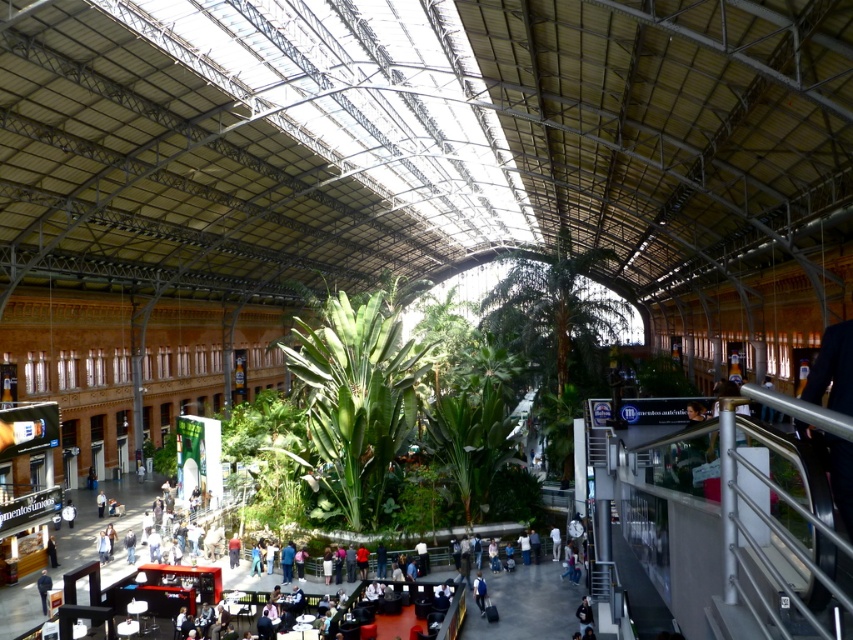
You are standing at the entrance of the station and want to reach the point marked at coordinate point [583,632]. The station has a rule that you must stay at least 20 meters away from any visitors. Is your current position compliant with the station rule?

The distance between you and the point [583,632] is 20.84 meters, which is more than the required 20 meters, so your current position is compliant with the station rule.

You are a visitor at the station and see two jackets hanging on a rack in the center. The blue fabric jacket at center and the white fabric jacket at center. Which jacket is shorter in height?

The blue fabric jacket at center is not as tall as the white fabric jacket at center, so the blue fabric jacket at center is shorter in height.

Consider the image. You are a delivery person carrying a 4 meter long package and need to navigate through the station. There are two jackets, a dark gray jacket at center and a blue fabric jacket at center. Can you pass between them without bending the package?

The dark gray jacket at center is 3.85 meters away from the blue fabric jacket at center. Since the package is 4 meters long, it cannot pass between them as the distance is shorter than the package length.